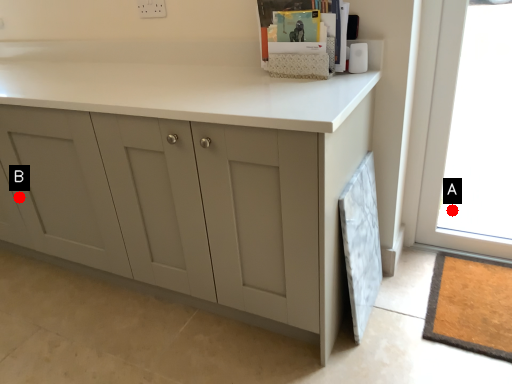
Question: Two points are circled on the image, labeled by A and B beside each circle. Which point appears farthest from the camera in this image?

Choices:
 (A) A is further
 (B) B is further

Answer: (A)